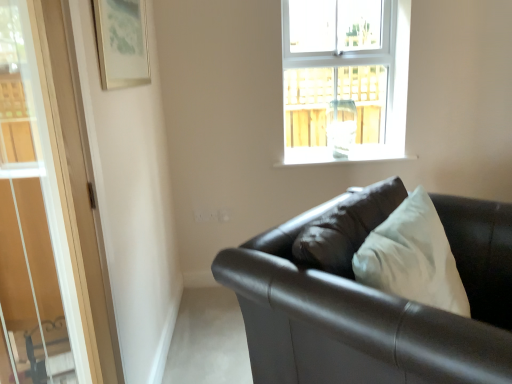
Question: Does metallic silver picture frame at upper left have a greater width compared to matte black couch at lower right?

Choices:
 (A) no
 (B) yes

Answer: (A)

Question: Would you say metallic silver picture frame at upper left is a long distance from matte black couch at lower right?

Choices:
 (A) no
 (B) yes

Answer: (B)

Question: From the image's perspective, is metallic silver picture frame at upper left beneath matte black couch at lower right?

Choices:
 (A) yes
 (B) no

Answer: (B)

Question: Considering the relative sizes of metallic silver picture frame at upper left and matte black couch at lower right in the image provided, is metallic silver picture frame at upper left taller than matte black couch at lower right?

Choices:
 (A) no
 (B) yes

Answer: (A)

Question: From the image's perspective, is metallic silver picture frame at upper left on matte black couch at lower right?

Choices:
 (A) no
 (B) yes

Answer: (B)

Question: Is matte black couch at lower right located within metallic silver picture frame at upper left?

Choices:
 (A) no
 (B) yes

Answer: (A)

Question: From the image's perspective, would you say clear glass window at upper center is positioned over matte black couch at lower right?

Choices:
 (A) yes
 (B) no

Answer: (A)

Question: Considering the relative positions of clear glass window at upper center and matte black couch at lower right in the image provided, is clear glass window at upper center to the left of matte black couch at lower right from the viewer's perspective?

Choices:
 (A) yes
 (B) no

Answer: (B)

Question: Is clear glass window at upper center bigger than matte black couch at lower right?

Choices:
 (A) yes
 (B) no

Answer: (B)

Question: Does clear glass window at upper center have a greater height compared to matte black couch at lower right?

Choices:
 (A) no
 (B) yes

Answer: (B)

Question: From a real-world perspective, does clear glass window at upper center stand above matte black couch at lower right?

Choices:
 (A) no
 (B) yes

Answer: (B)

Question: Is clear glass window at upper center placed right next to matte black couch at lower right?

Choices:
 (A) no
 (B) yes

Answer: (A)

Question: Are white smooth window sill at upper center and metallic silver picture frame at upper left located far from each other?

Choices:
 (A) no
 (B) yes

Answer: (B)